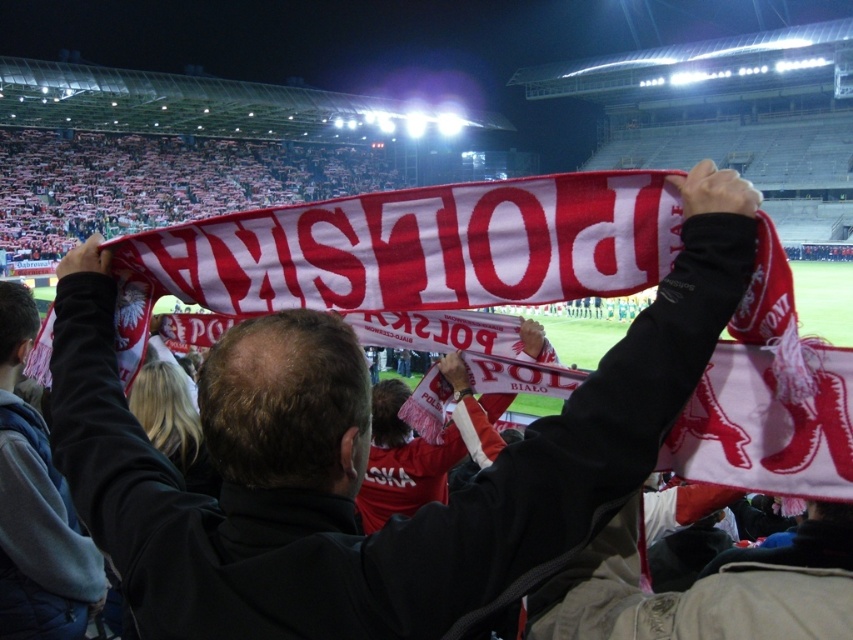
Question: Is matte red scarf at center behind gray fleece jacket at upper left?

Choices:
 (A) yes
 (B) no

Answer: (B)

Question: Which point appears closest to the camera in this image?

Choices:
 (A) (59, 582)
 (B) (195, 564)

Answer: (B)

Question: Which point is farther from the camera taking this photo?

Choices:
 (A) (325, 614)
 (B) (24, 452)

Answer: (B)

Question: Does matte red scarf at center appear on the right side of gray fleece jacket at upper left?

Choices:
 (A) yes
 (B) no

Answer: (A)

Question: Which object is closer to the camera taking this photo?

Choices:
 (A) matte red scarf at center
 (B) gray fleece jacket at upper left

Answer: (A)

Question: Does matte red scarf at center appear under gray fleece jacket at upper left?

Choices:
 (A) yes
 (B) no

Answer: (B)